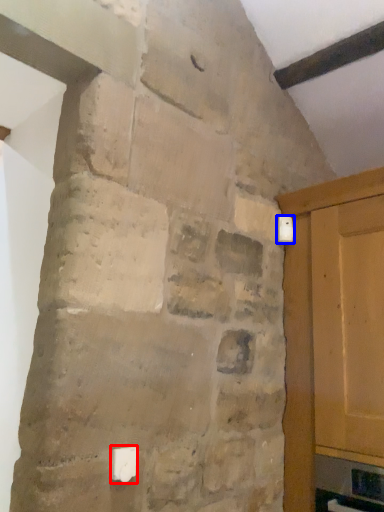
Question: Which object is closer to the camera taking this photo, light switch (highlighted by a red box) or light switch (highlighted by a blue box)?

Choices:
 (A) light switch
 (B) light switch

Answer: (A)